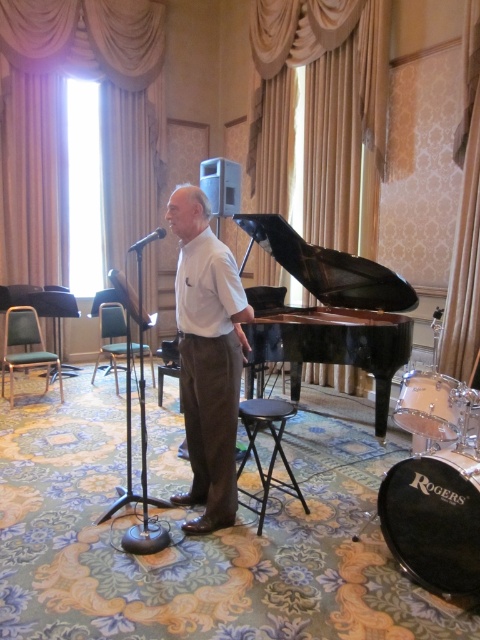
Measure the distance between point (x=430, y=513) and camera.

2.34 meters

What do you see at coordinates (433, 522) in the screenshot? The width and height of the screenshot is (480, 640). I see `black drumhead at lower right` at bounding box center [433, 522].

I want to click on black drumhead at lower right, so click(433, 522).

Which is behind, point (248, 346) or point (151, 241)?

Point (151, 241)

The image size is (480, 640). In order to click on white smooth shirt at center in this screenshot , I will do `click(207, 356)`.

Locate an element on the screen. The image size is (480, 640). white smooth shirt at center is located at coordinates (207, 356).

Does black polished piano at center appear over clear glass drum at lower right?

Yes.

Does point (324, 305) come closer to viewer compared to point (410, 392)?

No, (324, 305) is behind (410, 392).

This screenshot has width=480, height=640. What do you see at coordinates (323, 273) in the screenshot? I see `black polished piano at center` at bounding box center [323, 273].

Locate an element on the screen. black polished piano at center is located at coordinates (323, 273).